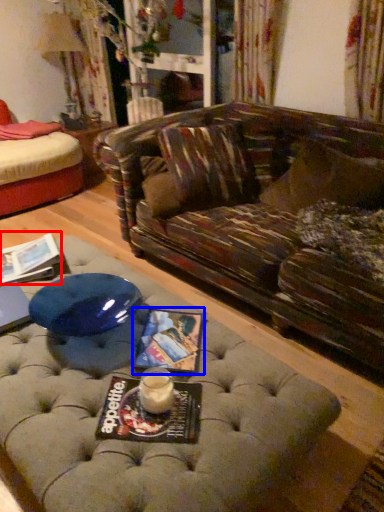
Question: Which of the following is the closest to the observer, magazine (highlighted by a red box) or magazine (highlighted by a blue box)?

Choices:
 (A) magazine
 (B) magazine

Answer: (B)